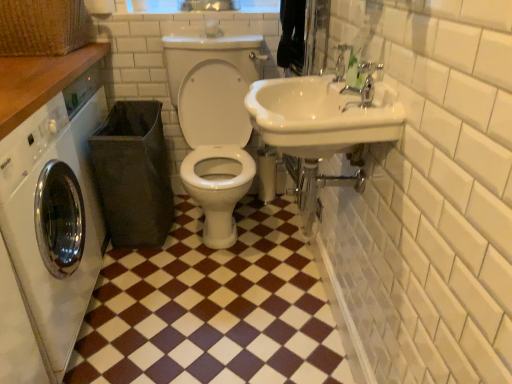
Question: Is white glossy sink at upper right wider than silver metallic faucet at upper right?

Choices:
 (A) no
 (B) yes

Answer: (B)

Question: From the image's perspective, is white glossy sink at upper right over silver metallic faucet at upper right?

Choices:
 (A) yes
 (B) no

Answer: (B)

Question: Is white glossy sink at upper right aimed at silver metallic faucet at upper right?

Choices:
 (A) yes
 (B) no

Answer: (B)

Question: Is white glossy sink at upper right outside silver metallic faucet at upper right?

Choices:
 (A) yes
 (B) no

Answer: (A)

Question: Would you say white glossy sink at upper right is a long distance from silver metallic faucet at upper right?

Choices:
 (A) yes
 (B) no

Answer: (B)

Question: Can you confirm if white glossy sink at upper right is taller than silver metallic faucet at upper right?

Choices:
 (A) yes
 (B) no

Answer: (A)

Question: Is silver metallic faucet at upper right far away from white glossy sink at upper right?

Choices:
 (A) yes
 (B) no

Answer: (B)

Question: Does silver metallic faucet at upper right have a greater width compared to white glossy sink at upper right?

Choices:
 (A) yes
 (B) no

Answer: (B)

Question: From a real-world perspective, is silver metallic faucet at upper right positioned over white glossy sink at upper right based on gravity?

Choices:
 (A) yes
 (B) no

Answer: (A)

Question: From the image's perspective, is silver metallic faucet at upper right beneath white glossy sink at upper right?

Choices:
 (A) yes
 (B) no

Answer: (B)

Question: Considering the relative sizes of silver metallic faucet at upper right and white glossy sink at upper right in the image provided, is silver metallic faucet at upper right bigger than white glossy sink at upper right?

Choices:
 (A) yes
 (B) no

Answer: (B)

Question: Is silver metallic faucet at upper right outside white glossy sink at upper right?

Choices:
 (A) no
 (B) yes

Answer: (A)

Question: From a real-world perspective, is wooden counter at upper left positioned over silver metallic faucet at upper right based on gravity?

Choices:
 (A) no
 (B) yes

Answer: (A)